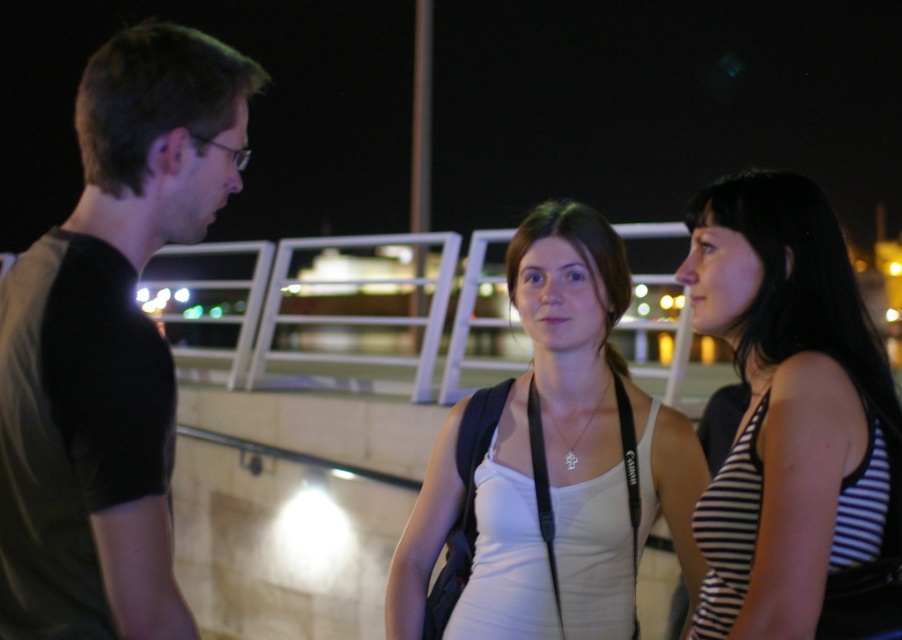
Question: Which point is closer to the camera?

Choices:
 (A) white fabric tank top at center
 (B) dark green t-shirt at left
 (C) striped fabric tank top at right

Answer: (B)

Question: Which object is the closest to the white fabric tank top at center?

Choices:
 (A) striped fabric tank top at right
 (B) dark green t-shirt at left

Answer: (A)

Question: Which point is closer to the camera?

Choices:
 (A) (24, 499)
 (B) (479, 557)

Answer: (A)

Question: Is striped fabric tank top at right above white fabric tank top at center?

Choices:
 (A) no
 (B) yes

Answer: (B)

Question: Is dark green t-shirt at left positioned in front of white fabric tank top at center?

Choices:
 (A) no
 (B) yes

Answer: (B)

Question: Is dark green t-shirt at left wider than striped fabric tank top at right?

Choices:
 (A) yes
 (B) no

Answer: (B)